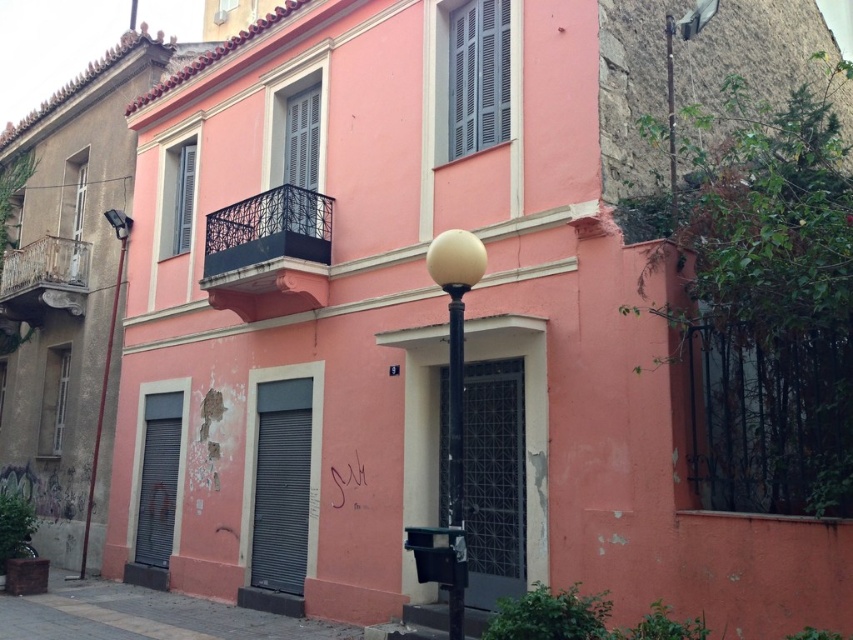
Question: Is brick pavement at lower left below metallic pole at left?

Choices:
 (A) no
 (B) yes

Answer: (B)

Question: Does brick pavement at lower left appear on the right side of metallic pole at left?

Choices:
 (A) yes
 (B) no

Answer: (A)

Question: Considering the relative positions of rusty metal balcony at upper left and metallic pole at left in the image provided, where is rusty metal balcony at upper left located with respect to metallic pole at left?

Choices:
 (A) left
 (B) right

Answer: (A)

Question: Which is farther from the metallic pole at left?

Choices:
 (A) white glossy lamp post at center
 (B) matte black lamp at upper left

Answer: (A)

Question: Which point is farther to the camera?

Choices:
 (A) black wrought iron balcony at upper center
 (B) brick pavement at lower left
 (C) white glossy lamp post at center
 (D) metallic pole at left

Answer: (D)

Question: Which point appears closest to the camera in this image?

Choices:
 (A) (120, 218)
 (B) (454, 460)
 (C) (258, 228)
 (D) (91, 512)

Answer: (B)